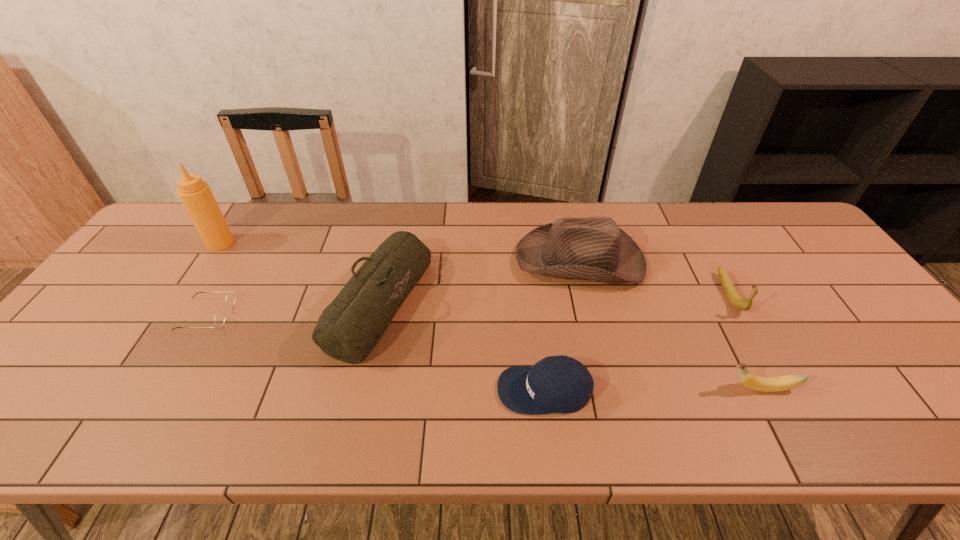
Where is `the tallest object`? The width and height of the screenshot is (960, 540). the tallest object is located at coordinates (195, 194).

Locate an element on the screen. The height and width of the screenshot is (540, 960). fedora is located at coordinates (592, 248).

Image resolution: width=960 pixels, height=540 pixels. Find the location of `the third object from left to right`. the third object from left to right is located at coordinates (348, 329).

The height and width of the screenshot is (540, 960). I want to click on the taller banana, so click(x=737, y=301).

Where is `the farther banana`? This screenshot has width=960, height=540. the farther banana is located at coordinates (737, 301).

Where is `the shorter banana`? the shorter banana is located at coordinates (781, 383).

Locate an element on the screen. baseball cap is located at coordinates (556, 384).

Find the location of a particular element. The image size is (960, 540). spectacles is located at coordinates (219, 320).

Find the location of a particular element. The height and width of the screenshot is (540, 960). vacant area situated 0.120m on the left of the condiment is located at coordinates (169, 243).

Where is `vacant region located 0.070m on the front of the fedora`? vacant region located 0.070m on the front of the fedora is located at coordinates (592, 312).